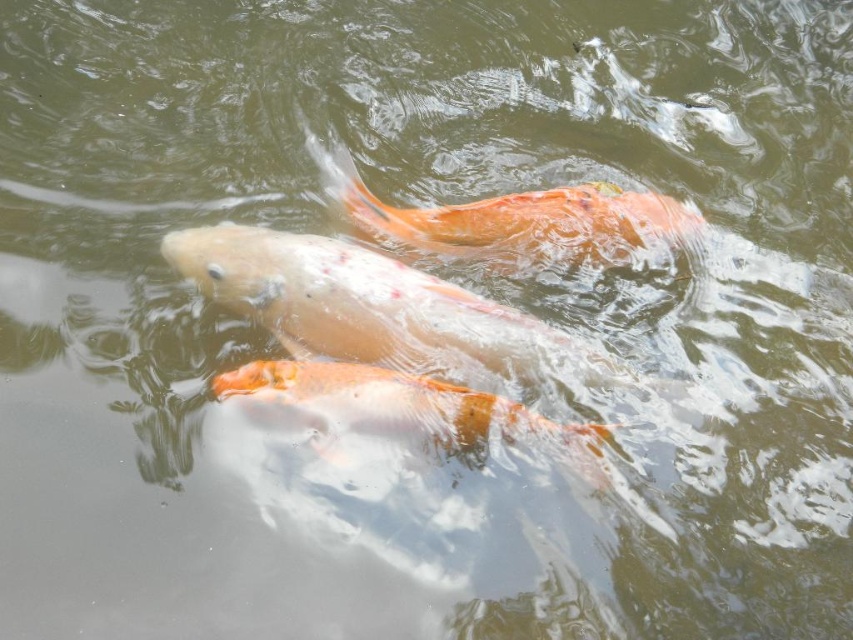
Can you confirm if orange glossy fish at center is smaller than orange glossy goldfish at center?

Correct, orange glossy fish at center occupies less space than orange glossy goldfish at center.

Who is taller, orange glossy fish at center or orange glossy goldfish at center?

With more height is orange glossy goldfish at center.

Image resolution: width=853 pixels, height=640 pixels. What do you see at coordinates (396, 406) in the screenshot?
I see `orange glossy fish at center` at bounding box center [396, 406].

The height and width of the screenshot is (640, 853). In order to click on orange glossy fish at center in this screenshot , I will do `click(396, 406)`.

Between speckled orange fish at center and orange glossy goldfish at center, which one has less height?

Standing shorter between the two is orange glossy goldfish at center.

Does speckled orange fish at center appear over orange glossy goldfish at center?

Actually, speckled orange fish at center is below orange glossy goldfish at center.

Between point (521, 321) and point (585, 188), which one is positioned in front?

Point (521, 321)

This screenshot has height=640, width=853. What are the coordinates of `speckled orange fish at center` in the screenshot? It's located at (361, 304).

Between speckled orange fish at center and orange glossy fish at center, which one is positioned lower?

orange glossy fish at center

Is speckled orange fish at center behind orange glossy fish at center?

Yes, it is.

Describe the element at coordinates (361, 304) in the screenshot. I see `speckled orange fish at center` at that location.

Where is `speckled orange fish at center`? This screenshot has height=640, width=853. speckled orange fish at center is located at coordinates (361, 304).